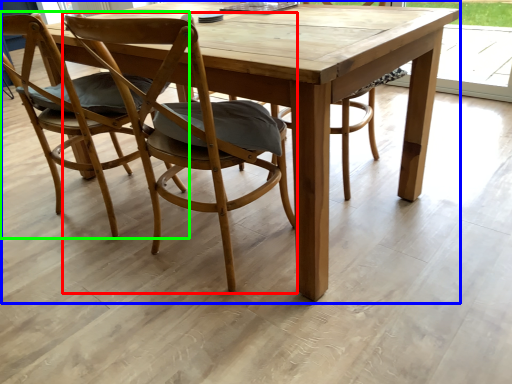
Question: Estimate the real-world distances between objects in this image. Which object is farther from chair (highlighted by a red box), picnic table (highlighted by a blue box) or chair (highlighted by a green box)?

Choices:
 (A) picnic table
 (B) chair

Answer: (B)